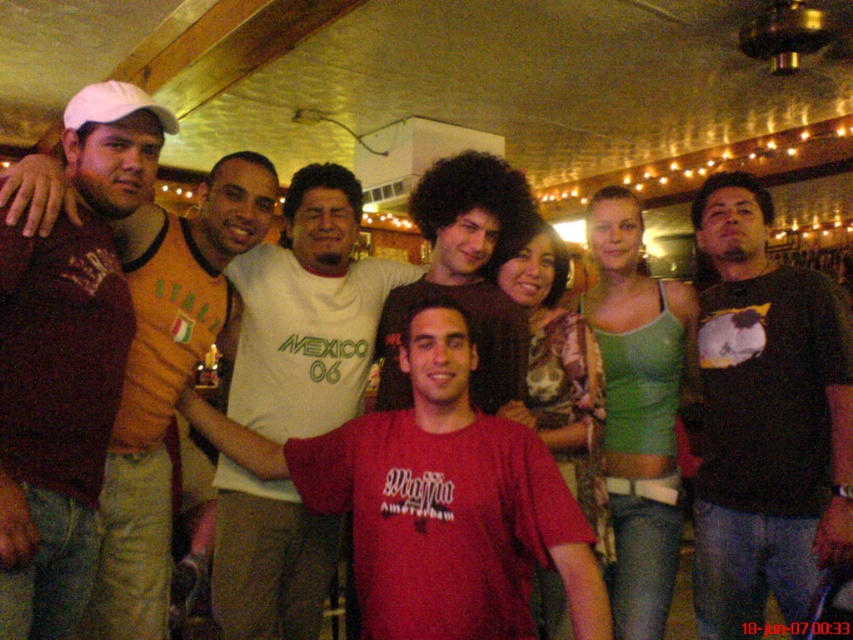
Is matte red t-shirt at center thinner than dark brown hair at center?

No, matte red t-shirt at center is not thinner than dark brown hair at center.

Can you confirm if matte red t-shirt at center is smaller than dark brown hair at center?

No.

Find the location of a particular element. matte red t-shirt at center is located at coordinates (436, 500).

Is white cotton shirt at center bigger than dark brown hair at center?

Yes, white cotton shirt at center is bigger than dark brown hair at center.

Is white cotton shirt at center to the left of dark brown hair at center from the viewer's perspective?

Indeed, white cotton shirt at center is positioned on the left side of dark brown hair at center.

This screenshot has width=853, height=640. What do you see at coordinates (308, 312) in the screenshot?
I see `white cotton shirt at center` at bounding box center [308, 312].

Locate an element on the screen. The width and height of the screenshot is (853, 640). white cotton shirt at center is located at coordinates (308, 312).

Is black t-shirt at center smaller than white cotton shirt at center?

Correct, black t-shirt at center occupies less space than white cotton shirt at center.

Identify the location of black t-shirt at center. (766, 419).